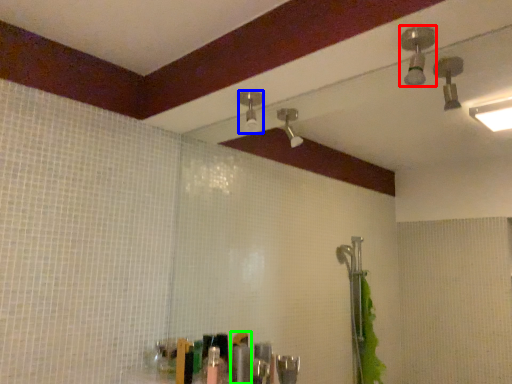
Question: Estimate the real-world distances between objects in this image. Which object is closer to shower (highlighted by a red box), shower (highlighted by a blue box) or toiletry (highlighted by a green box)?

Choices:
 (A) shower
 (B) toiletry

Answer: (A)